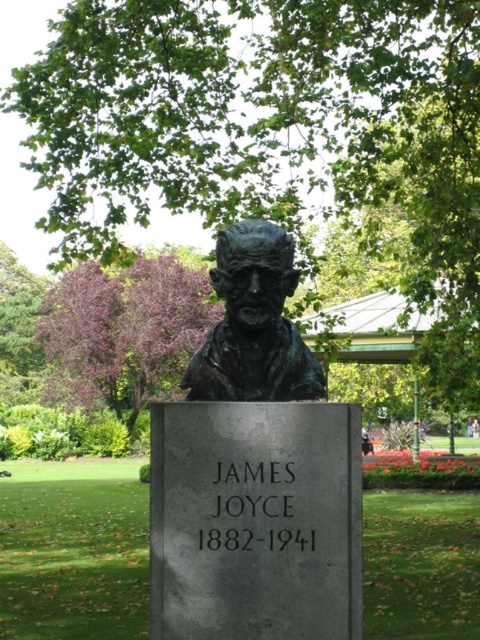
Question: Can you confirm if green leafy tree at upper center is positioned above bronze bust at center?

Choices:
 (A) yes
 (B) no

Answer: (A)

Question: Which point is closer to the camera?

Choices:
 (A) (256, 284)
 (B) (282, 115)

Answer: (A)

Question: Which point is farther to the camera?

Choices:
 (A) bronze bust at center
 (B) purple leafy tree at upper left

Answer: (B)

Question: Which of the following is the closest to the observer?

Choices:
 (A) (189, 84)
 (B) (171, 269)

Answer: (A)

Question: Is green leafy tree at upper center positioned behind purple leafy tree at upper left?

Choices:
 (A) no
 (B) yes

Answer: (A)

Question: Does green leafy tree at upper center appear on the left side of bronze bust at center?

Choices:
 (A) no
 (B) yes

Answer: (B)